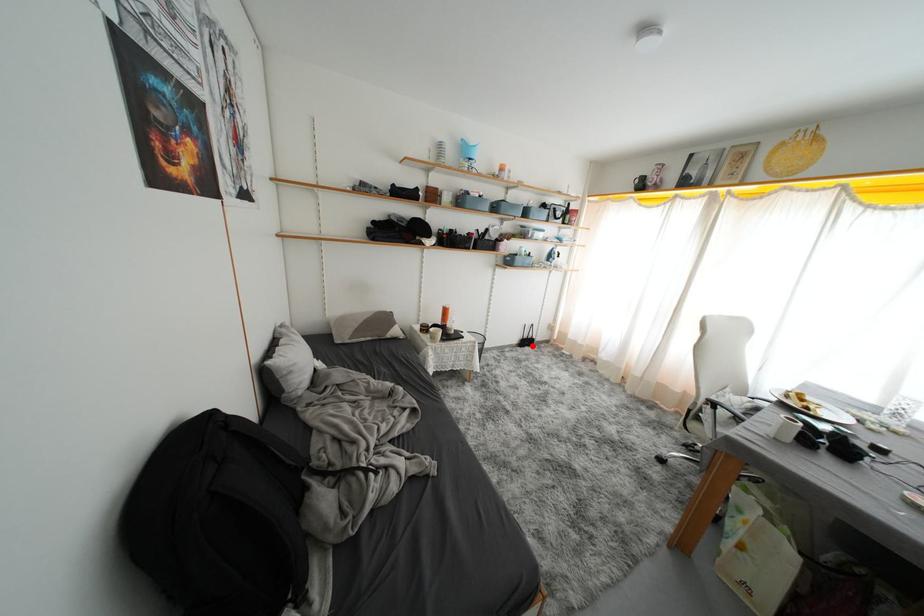
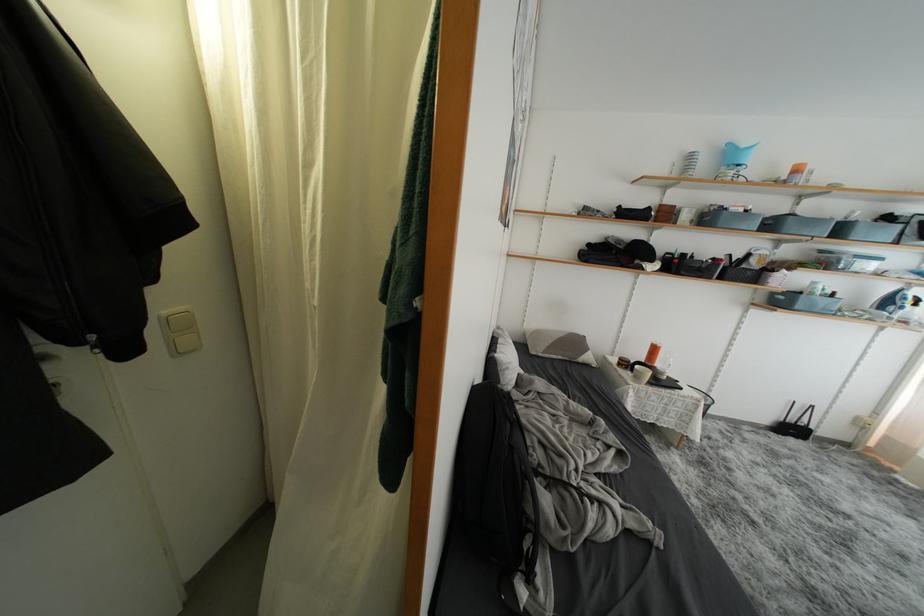
The point at the highlighted location is marked in the first image. Where is the corresponding point in the second image?

(797, 434)